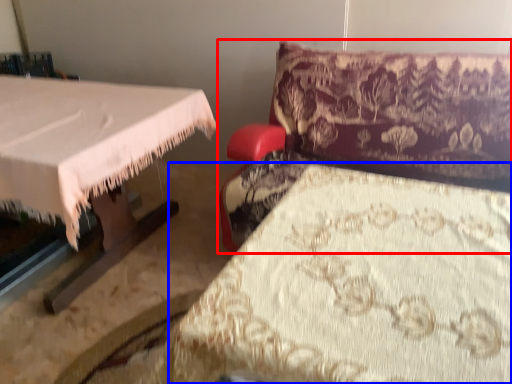
Question: Among these objects, which one is nearest to the camera, furniture (highlighted by a red box) or sheet (highlighted by a blue box)?

Choices:
 (A) furniture
 (B) sheet

Answer: (B)